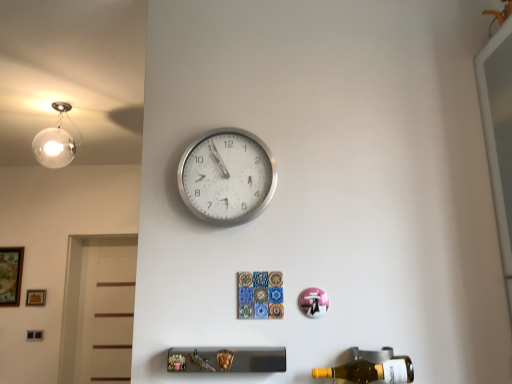
Question: Considering the relative positions of wooden framed artwork at left, which ranks as the 2th picture frame in right-to-left order, and yellow glass bottle at lower right in the image provided, is wooden framed artwork at left, which ranks as the 2th picture frame in right-to-left order, to the right of yellow glass bottle at lower right from the viewer's perspective?

Choices:
 (A) no
 (B) yes

Answer: (A)

Question: Does wooden framed artwork at left, which ranks as the 2th picture frame in right-to-left order, have a greater width compared to yellow glass bottle at lower right?

Choices:
 (A) no
 (B) yes

Answer: (A)

Question: Is wooden framed artwork at left, the first picture frame from the left, completely or partially outside of yellow glass bottle at lower right?

Choices:
 (A) no
 (B) yes

Answer: (B)

Question: Can you confirm if wooden framed artwork at left, the first picture frame from the left, is bigger than yellow glass bottle at lower right?

Choices:
 (A) no
 (B) yes

Answer: (A)

Question: Is wooden framed artwork at left, which ranks as the 2th picture frame in right-to-left order, looking in the opposite direction of yellow glass bottle at lower right?

Choices:
 (A) yes
 (B) no

Answer: (B)

Question: Is point (6, 253) positioned closer to the camera than point (254, 147)?

Choices:
 (A) farther
 (B) closer

Answer: (A)

Question: From the image's perspective, relative to silver metallic wall clock at upper center, is wooden framed artwork at left, the first picture frame from the left, above or below?

Choices:
 (A) above
 (B) below

Answer: (B)

Question: Considering the positions of wooden framed artwork at left, the first picture frame from the left, and silver metallic wall clock at upper center in the image, is wooden framed artwork at left, the first picture frame from the left, bigger or smaller than silver metallic wall clock at upper center?

Choices:
 (A) small
 (B) big

Answer: (A)

Question: In terms of width, does wooden framed artwork at left, which ranks as the 2th picture frame in right-to-left order, look wider or thinner when compared to silver metallic wall clock at upper center?

Choices:
 (A) wide
 (B) thin

Answer: (B)

Question: Based on their positions, is silver metallic wall clock at upper center located to the left or right of wooden framed artwork at left, which ranks as the 2th picture frame in right-to-left order?

Choices:
 (A) left
 (B) right

Answer: (B)

Question: Considering the positions of silver metallic wall clock at upper center and wooden framed artwork at left, which ranks as the 2th picture frame in right-to-left order, in the image, is silver metallic wall clock at upper center taller or shorter than wooden framed artwork at left, which ranks as the 2th picture frame in right-to-left order,?

Choices:
 (A) short
 (B) tall

Answer: (A)

Question: Is point (182, 180) positioned closer to the camera than point (0, 299)?

Choices:
 (A) closer
 (B) farther

Answer: (A)

Question: From a real-world perspective, is silver metallic wall clock at upper center above or below wooden framed artwork at left, which ranks as the 2th picture frame in right-to-left order?

Choices:
 (A) below
 (B) above

Answer: (B)

Question: From the image's perspective, relative to wooden framed artwork at left, the first picture frame from the left, is wooden picture frame at lower left, the 1th picture frame viewed from the right, above or below?

Choices:
 (A) above
 (B) below

Answer: (B)

Question: From a real-world perspective, relative to wooden framed artwork at left, which ranks as the 2th picture frame in right-to-left order, is wooden picture frame at lower left, the 1th picture frame viewed from the right, vertically above or below?

Choices:
 (A) above
 (B) below

Answer: (B)